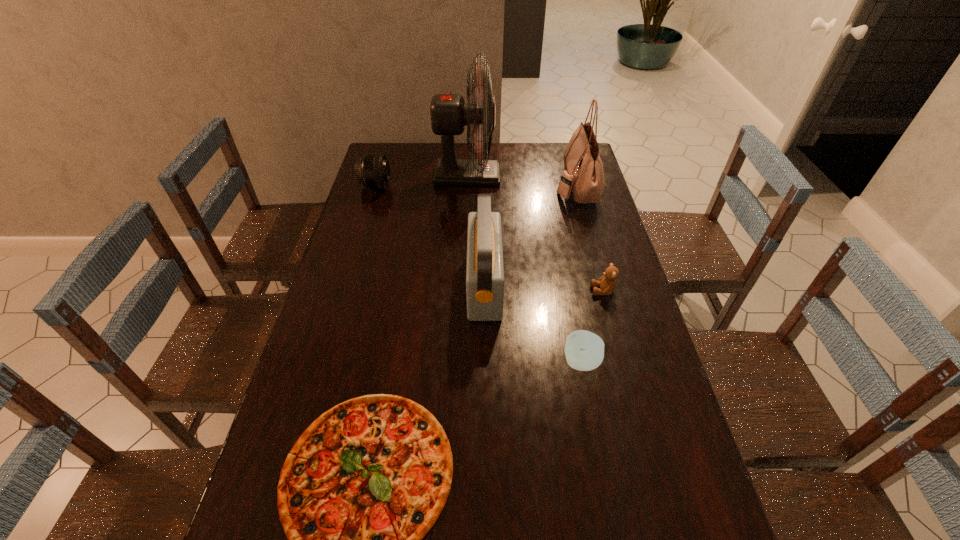
Locate an element on the screen. The width and height of the screenshot is (960, 540). vacant space located on the front-facing side of the fifth shortest object is located at coordinates tap(428, 285).

The height and width of the screenshot is (540, 960). Find the location of `vacant space located on the front-facing side of the fifth shortest object`. vacant space located on the front-facing side of the fifth shortest object is located at coordinates (356, 285).

Find the location of a particular element. This screenshot has width=960, height=540. vacant space located on the front-facing side of the fifth shortest object is located at coordinates (421, 285).

In order to click on vacant area located on the front-facing side of the telephoto lens in this screenshot , I will do `click(447, 186)`.

In order to click on vacant space situated on the right of the sixth farthest object in this screenshot , I will do [x=619, y=362].

Find the location of a particular element. free space located 0.270m on the front-facing side of the teddy bear is located at coordinates (501, 291).

In order to click on vacant space situated 0.260m on the front-facing side of the teddy bear in this screenshot , I will do `click(504, 291)`.

Where is `vacant space located 0.210m on the front-facing side of the teddy bear`? vacant space located 0.210m on the front-facing side of the teddy bear is located at coordinates (521, 291).

Find the location of a particular element. fan that is positioned at the far edge is located at coordinates (449, 113).

At what (x,y) coordinates should I click in order to perform the action: click on handbag located in the far edge section of the desktop. Please return your answer as a coordinate pair (x, y). Looking at the image, I should click on (583, 176).